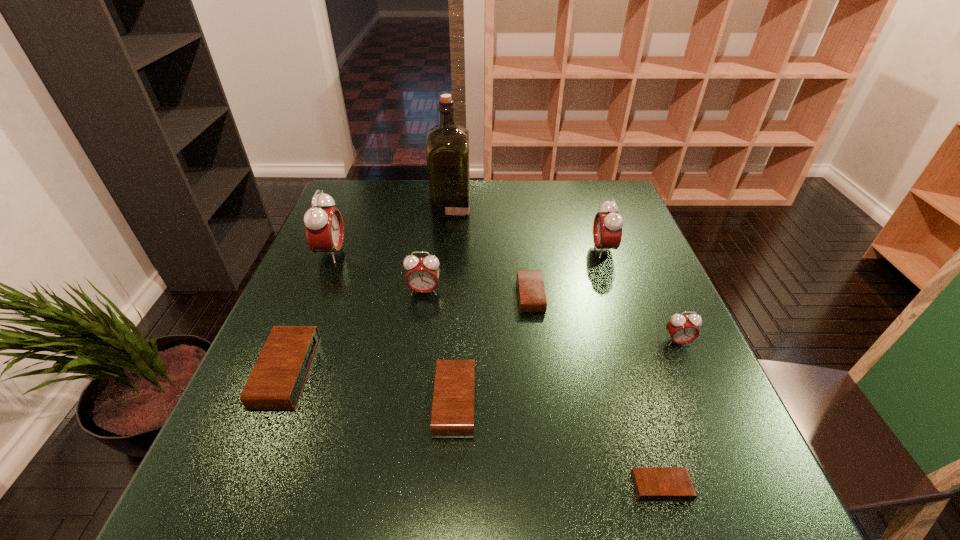
Where is `vacant space that's between the rightmost pink alarm clock and the second smallest pink alarm clock`? This screenshot has width=960, height=540. vacant space that's between the rightmost pink alarm clock and the second smallest pink alarm clock is located at coordinates point(551,316).

You are a GUI agent. You are given a task and a screenshot of the screen. Output one action in this format:
    pyautogui.click(x=<x>, y=<y>)
    Task: Click on the unoccupied position between the rightmost pink alarm clock and the farthest object
    The image size is (960, 540).
    Given the screenshot: What is the action you would take?
    pyautogui.click(x=564, y=274)

Locate an element on the screen. free area in between the third biggest pink alarm clock and the rightmost object is located at coordinates (551, 316).

At what (x,y) coordinates should I click in order to perform the action: click on free spot between the fifth alarm clock from left to right and the fourth tallest object. Please return your answer as a coordinate pair (x, y). Looking at the image, I should click on (477, 293).

The height and width of the screenshot is (540, 960). Find the location of `vacant space that is in between the third biggest pink alarm clock and the biggest pink alarm clock`. vacant space that is in between the third biggest pink alarm clock and the biggest pink alarm clock is located at coordinates (378, 272).

Find the location of a particular element. This screenshot has height=540, width=960. vacant space that is in between the tallest alarm clock and the nearest object is located at coordinates (496, 370).

Find the location of a particular element. The image size is (960, 540). object that stands as the closest to the second black alarm clock from left to right is located at coordinates (532, 298).

This screenshot has width=960, height=540. Identify the location of object that is the fifth closest to the biggest pink alarm clock. (532, 298).

Find the location of a particular element. alarm clock that is the seventh closest to the second nearest pink alarm clock is located at coordinates (652, 484).

Choose which alarm clock is the seventh nearest neighbor to the smallest black alarm clock. Please provide its 2D coordinates. Your answer should be formatted as a tuple, i.e. [(x, y)], where the tuple contains the x and y coordinates of a point satisfying the conditions above.

[(324, 226)]